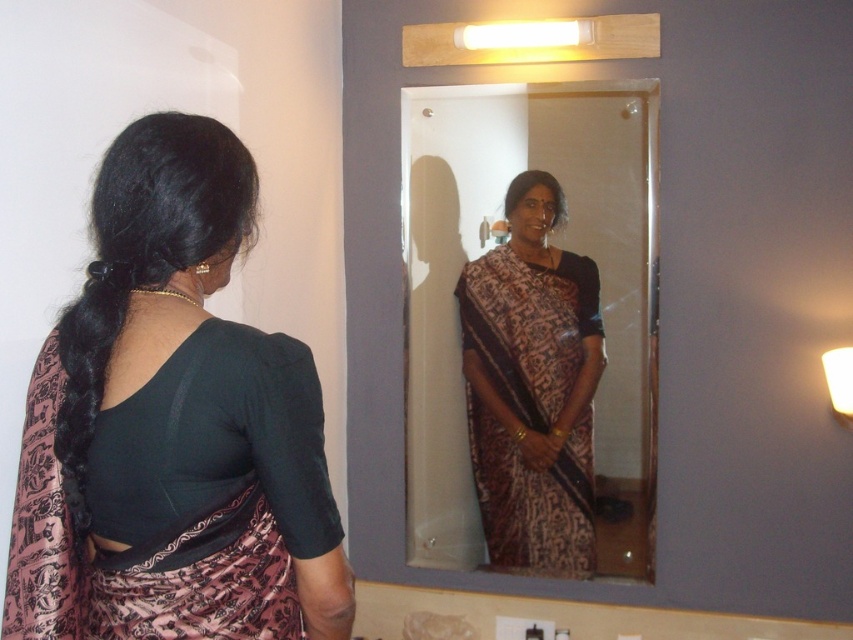
Question: Estimate the real-world distances between objects in this image. Which object is closer to the matte black blouse at center?

Choices:
 (A) brown printed saree at center
 (B) matte glass mirror at center

Answer: (B)

Question: Among these points, which one is nearest to the camera?

Choices:
 (A) (633, 323)
 (B) (496, 355)
 (C) (96, 282)

Answer: (C)

Question: Considering the relative positions of matte black blouse at center and brown printed saree at center in the image provided, where is matte black blouse at center located with respect to brown printed saree at center?

Choices:
 (A) below
 (B) above

Answer: (B)

Question: Does matte black blouse at center have a lesser width compared to matte glass mirror at center?

Choices:
 (A) yes
 (B) no

Answer: (A)

Question: Among these points, which one is farthest from the camera?

Choices:
 (A) (287, 634)
 (B) (564, 272)

Answer: (B)

Question: Does matte black blouse at center have a greater width compared to matte glass mirror at center?

Choices:
 (A) yes
 (B) no

Answer: (B)